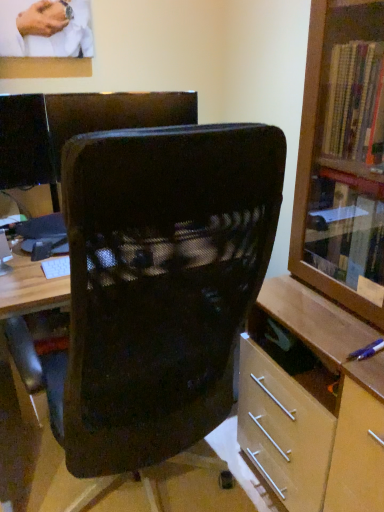
Question: Does wooden cabinet at right have a smaller size compared to black mesh chair at center?

Choices:
 (A) no
 (B) yes

Answer: (B)

Question: Would you consider wooden cabinet at right to be distant from black mesh chair at center?

Choices:
 (A) no
 (B) yes

Answer: (A)

Question: From a real-world perspective, is wooden cabinet at right physically below black mesh chair at center?

Choices:
 (A) yes
 (B) no

Answer: (B)

Question: Can you confirm if wooden cabinet at right is positioned to the left of black mesh chair at center?

Choices:
 (A) no
 (B) yes

Answer: (A)

Question: Does wooden cabinet at right have a lesser height compared to black mesh chair at center?

Choices:
 (A) yes
 (B) no

Answer: (B)

Question: Is wooden cabinet at right aimed at black mesh chair at center?

Choices:
 (A) yes
 (B) no

Answer: (A)

Question: From a real-world perspective, is black mesh chair at center under wooden cabinet at right?

Choices:
 (A) no
 (B) yes

Answer: (B)

Question: Is black mesh chair at center to the right of wooden cabinet at right from the viewer's perspective?

Choices:
 (A) no
 (B) yes

Answer: (A)

Question: Can you see black mesh chair at center touching wooden cabinet at right?

Choices:
 (A) no
 (B) yes

Answer: (A)

Question: From the image's perspective, is black mesh chair at center beneath wooden cabinet at right?

Choices:
 (A) yes
 (B) no

Answer: (A)

Question: Does black mesh chair at center turn towards wooden cabinet at right?

Choices:
 (A) no
 (B) yes

Answer: (A)

Question: Is black mesh chair at center outside wooden cabinet at right?

Choices:
 (A) yes
 (B) no

Answer: (A)

Question: From the image's perspective, is black mesh chair at center above or below wooden cabinet at right?

Choices:
 (A) below
 (B) above

Answer: (A)